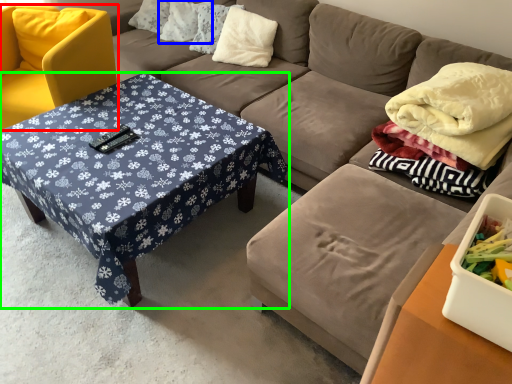
Question: Which is nearer to the chair (highlighted by a red box)? pillow (highlighted by a blue box) or coffee table (highlighted by a green box).

Choices:
 (A) pillow
 (B) coffee table

Answer: (B)